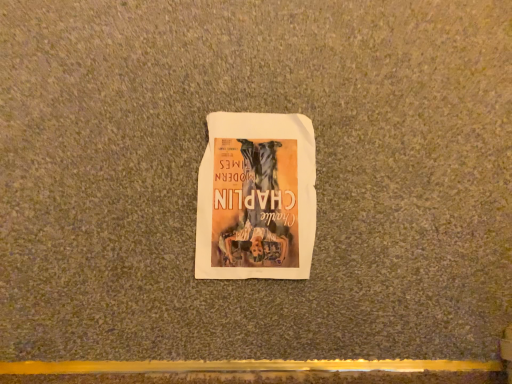
The image size is (512, 384). Identify the location of matte paper poster at center. (256, 197).

Measure the distance between point [275,259] and camera.

A distance of 71.30 centimeters exists between point [275,259] and camera.

This screenshot has width=512, height=384. What do you see at coordinates (256, 197) in the screenshot?
I see `matte paper poster at center` at bounding box center [256, 197].

I want to click on matte paper poster at center, so click(x=256, y=197).